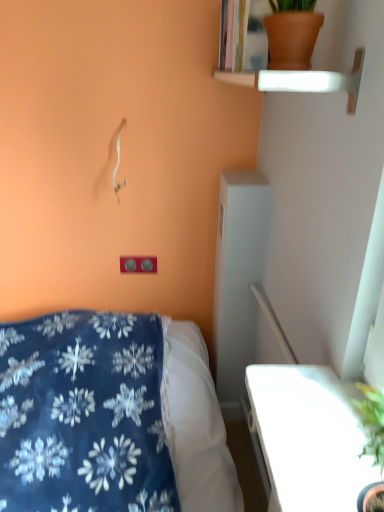
Find the location of a particular element. terracotta clay pot at upper right is located at coordinates (292, 39).

What do you see at coordinates (292, 39) in the screenshot? I see `terracotta clay pot at upper right` at bounding box center [292, 39].

What is the approximate height of matte plastic outlet at lower center?

It is 8.69 centimeters.

What do you see at coordinates (138, 264) in the screenshot?
I see `matte plastic outlet at lower center` at bounding box center [138, 264].

The width and height of the screenshot is (384, 512). Identify the location of matte plastic outlet at lower center. (138, 264).

Measure the distance between matte plastic outlet at lower center and camera.

matte plastic outlet at lower center and camera are 6.00 feet apart from each other.

Image resolution: width=384 pixels, height=512 pixels. Identify the location of terracotta clay pot at upper right. (292, 39).

In the scene shown: In the image, is matte plastic outlet at lower center on the left side or the right side of terracotta clay pot at upper right?

matte plastic outlet at lower center is to the left of terracotta clay pot at upper right.

Between matte plastic outlet at lower center and terracotta clay pot at upper right, which one is positioned behind?

matte plastic outlet at lower center is further away from the camera.

Does point (124, 262) appear closer or farther from the camera than point (290, 32)?

Point (124, 262) is positioned farther from the camera compared to point (290, 32).

From the image's perspective, which one is positioned lower, matte plastic outlet at lower center or terracotta clay pot at upper right?

From the image's view, matte plastic outlet at lower center is below.

From a real-world perspective, is matte plastic outlet at lower center above or below terracotta clay pot at upper right?

matte plastic outlet at lower center is situated lower than terracotta clay pot at upper right in the real world.

Looking at this image, which object is thinner, matte plastic outlet at lower center or terracotta clay pot at upper right?

With smaller width is matte plastic outlet at lower center.

Can you confirm if matte plastic outlet at lower center is shorter than terracotta clay pot at upper right?

Yes, matte plastic outlet at lower center is shorter than terracotta clay pot at upper right.

Considering the sizes of matte plastic outlet at lower center and terracotta clay pot at upper right in the image, is matte plastic outlet at lower center bigger or smaller than terracotta clay pot at upper right?

Considering their sizes, matte plastic outlet at lower center takes up less space than terracotta clay pot at upper right.

Does matte plastic outlet at lower center contain terracotta clay pot at upper right?

Actually, terracotta clay pot at upper right is outside matte plastic outlet at lower center.

Is matte plastic outlet at lower center beside terracotta clay pot at upper right?

matte plastic outlet at lower center and terracotta clay pot at upper right are not in contact.

Could you tell me if matte plastic outlet at lower center is facing terracotta clay pot at upper right?

No, matte plastic outlet at lower center does not turn towards terracotta clay pot at upper right.

Can you tell me how much matte plastic outlet at lower center and terracotta clay pot at upper right differ in facing direction?

The angle between the facing direction of matte plastic outlet at lower center and the facing direction of terracotta clay pot at upper right is 90.1 degrees.

Where is `flowerpot that appears above the matte plastic outlet at lower center (from a real-world perspective)`? This screenshot has height=512, width=384. flowerpot that appears above the matte plastic outlet at lower center (from a real-world perspective) is located at coordinates (292, 39).

Is terracotta clay pot at upper right at the right side of matte plastic outlet at lower center?

Correct, you'll find terracotta clay pot at upper right to the right of matte plastic outlet at lower center.

Considering their positions, is terracotta clay pot at upper right located in front of or behind matte plastic outlet at lower center?

In the image, terracotta clay pot at upper right appears in front of matte plastic outlet at lower center.

Does point (318, 28) come closer to viewer compared to point (153, 264)?

Yes, it is.

From the image's perspective, which is above, terracotta clay pot at upper right or matte plastic outlet at lower center?

terracotta clay pot at upper right.

From a real-world perspective, is terracotta clay pot at upper right positioned above or below matte plastic outlet at lower center?

terracotta clay pot at upper right is above matte plastic outlet at lower center.

Considering the sizes of terracotta clay pot at upper right and matte plastic outlet at lower center in the image, is terracotta clay pot at upper right wider or thinner than matte plastic outlet at lower center?

Clearly, terracotta clay pot at upper right has more width compared to matte plastic outlet at lower center.

Can you confirm if terracotta clay pot at upper right is shorter than matte plastic outlet at lower center?

No.

Is terracotta clay pot at upper right bigger or smaller than matte plastic outlet at lower center?

Clearly, terracotta clay pot at upper right is larger in size than matte plastic outlet at lower center.

Is terracotta clay pot at upper right outside of matte plastic outlet at lower center?

terracotta clay pot at upper right lies outside matte plastic outlet at lower center's area.

In the scene shown: Is there a large distance between terracotta clay pot at upper right and matte plastic outlet at lower center?

Yes.

Is terracotta clay pot at upper right facing towards matte plastic outlet at lower center?

No, terracotta clay pot at upper right does not turn towards matte plastic outlet at lower center.

What's the angular difference between terracotta clay pot at upper right and matte plastic outlet at lower center's facing directions?

They differ by 90.1 degrees in their facing directions.

The width and height of the screenshot is (384, 512). I want to click on flowerpot above the matte plastic outlet at lower center (from the image's perspective), so click(292, 39).

This screenshot has width=384, height=512. Identify the location of electric outlet on the left side of terracotta clay pot at upper right. (138, 264).

The height and width of the screenshot is (512, 384). In order to click on electric outlet below the terracotta clay pot at upper right (from a real-world perspective) in this screenshot , I will do `click(138, 264)`.